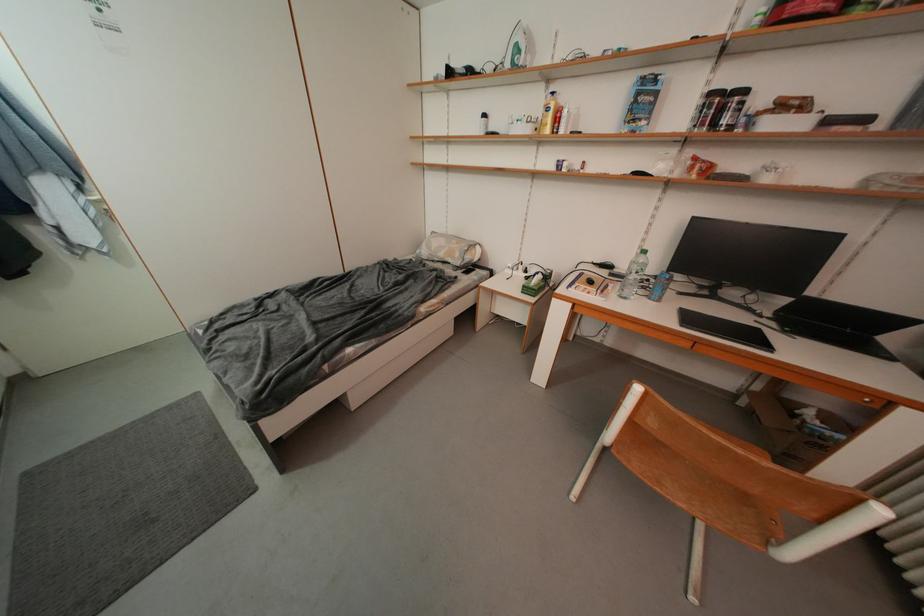
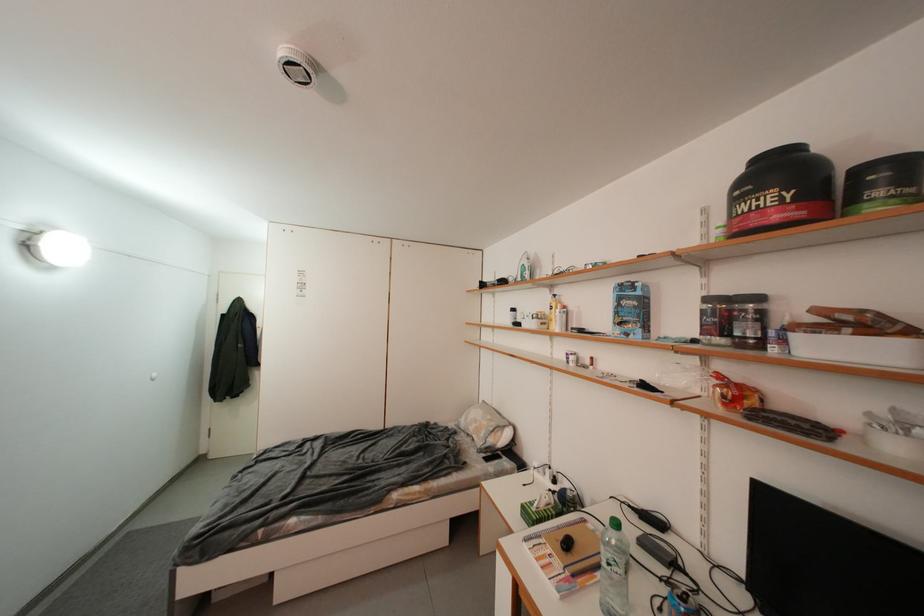
Find the pixel in the second image that matches pixel 754 95 in the first image.

(766, 301)